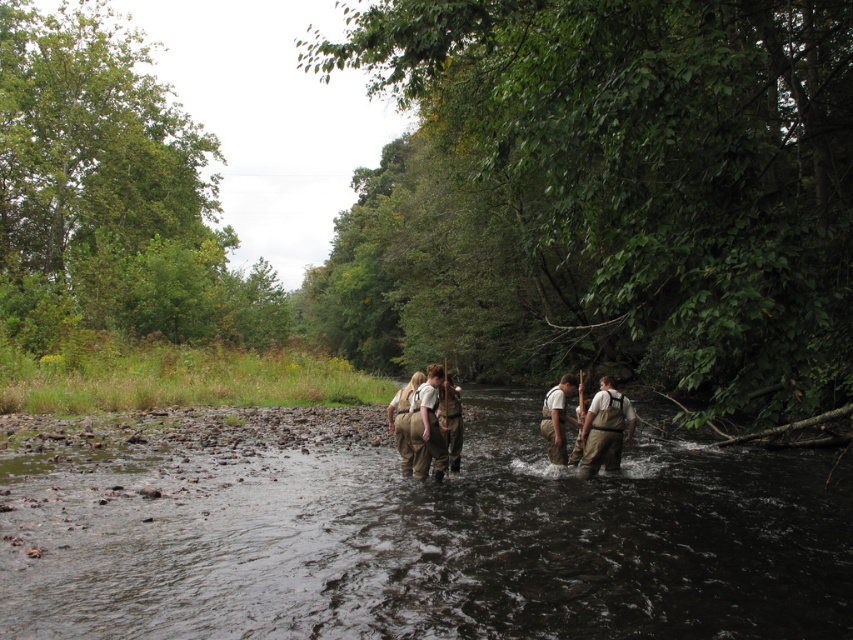
Does brown fabric river at center have a larger size compared to brown fabric backpack at center?

Indeed, brown fabric river at center has a larger size compared to brown fabric backpack at center.

Is brown fabric river at center to the right of brown fabric backpack at center from the viewer's perspective?

No, brown fabric river at center is not to the right of brown fabric backpack at center.

Between point (131, 563) and point (421, 380), which one is positioned behind?

Point (421, 380)

At what (x,y) coordinates should I click in order to perform the action: click on brown fabric river at center. Please return your answer as a coordinate pair (x, y). The height and width of the screenshot is (640, 853). Looking at the image, I should click on (415, 536).

Is brown cotton shirt at center shorter than brown leather backpack at center?

No, brown cotton shirt at center is not shorter than brown leather backpack at center.

Between brown cotton shirt at center and brown leather backpack at center, which one appears on the left side from the viewer's perspective?

brown cotton shirt at center is more to the left.

Who is more forward, (428, 444) or (450, 461)?

Point (428, 444) is more forward.

This screenshot has height=640, width=853. I want to click on brown cotton shirt at center, so click(427, 426).

The width and height of the screenshot is (853, 640). I want to click on brown fabric pants at center, so click(556, 419).

Can you confirm if brown fabric pants at center is positioned below brown fabric backpack at center?

No, brown fabric pants at center is not below brown fabric backpack at center.

Where is `brown fabric pants at center`? The width and height of the screenshot is (853, 640). brown fabric pants at center is located at coordinates (556, 419).